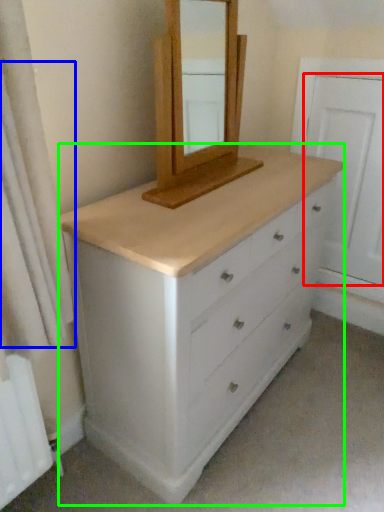
Question: Based on their relative distances, which object is nearer to screen door (highlighted by a red box)? Choose from shower curtain (highlighted by a blue box) and chest of drawers (highlighted by a green box).

Choices:
 (A) shower curtain
 (B) chest of drawers

Answer: (B)